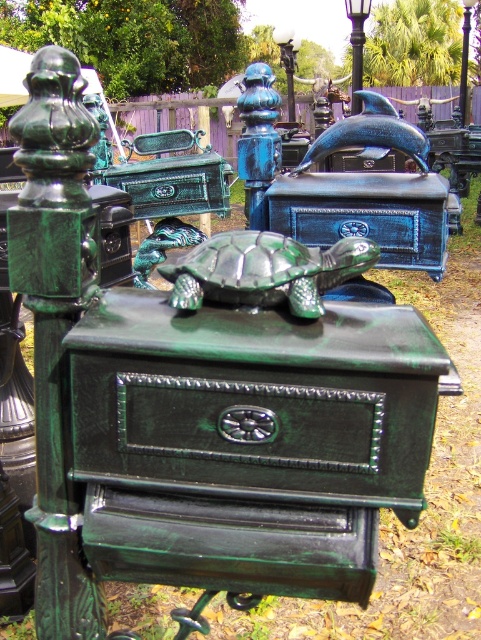
You are a customer at an outdoor market and want to find the green glossy drawer at center. You see the green patina lamp post at upper center in the distance. Which object is closer to you?

The green glossy drawer at center is closer to you because it is positioned below the green patina lamp post at upper center, which is further away.

Looking at this image, you are standing in front of the mailbox display and need to locate the green glossy drawer at center and the polished metal lamp post at center. Which one is positioned to the left of the other?

The green glossy drawer at center is positioned to the left of the polished metal lamp post at center.

You are a delivery person trying to place a package between the green glossy drawer at center and the green patina lamp post at upper center. The package requires a space of 10 meters. Can you fit it there?

The distance between the green glossy drawer at center and the green patina lamp post at upper center is 11.16 meters, so yes, the package can fit as the required space of 10 meters is less than the available distance.